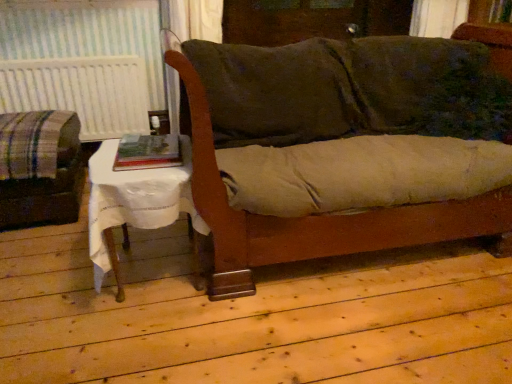
Question: Is point pyautogui.click(x=322, y=241) positioned closer to the camera than point pyautogui.click(x=62, y=66)?

Choices:
 (A) closer
 (B) farther

Answer: (A)

Question: From their relative heights in the image, would you say velvet green couch at center is taller or shorter than white textured radiator at left?

Choices:
 (A) tall
 (B) short

Answer: (A)

Question: Based on their relative distances, which object is farther from the hardcover book at center?

Choices:
 (A) white cloth-covered table at lower left
 (B) velvet green couch at center
 (C) plaid fabric couch at left
 (D) white textured radiator at left

Answer: (D)

Question: Estimate the real-world distances between objects in this image. Which object is closer to the white textured radiator at left?

Choices:
 (A) white cloth-covered table at lower left
 (B) plaid fabric couch at left
 (C) hardcover book at center
 (D) velvet green couch at center

Answer: (B)